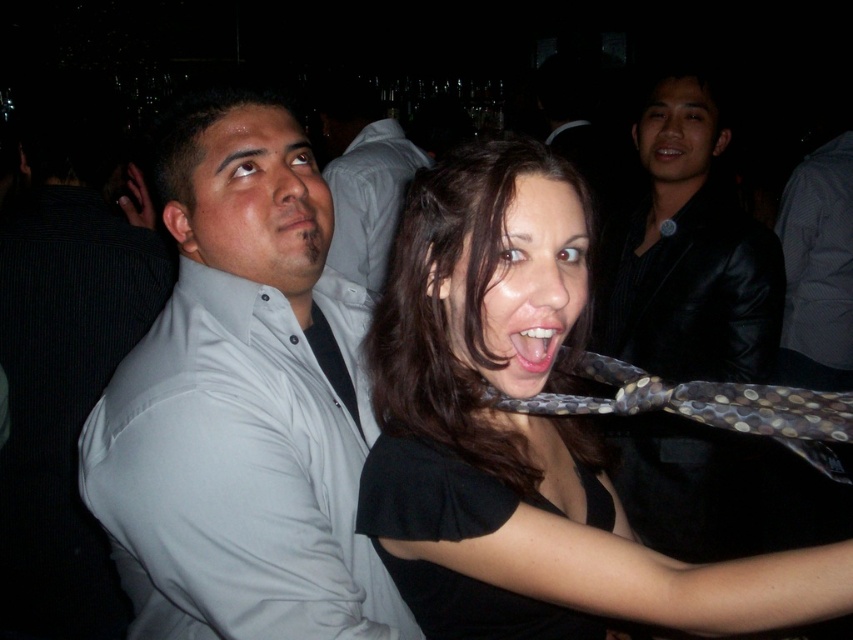
Is polka dot fabric tie at center taller than black leather jacket at upper right?

No.

Who is positioned more to the left, polka dot fabric tie at center or black leather jacket at upper right?

polka dot fabric tie at center is more to the left.

Based on the photo, who is more distant from viewer, (535, 484) or (695, 317)?

Point (695, 317)

Locate an element on the screen. polka dot fabric tie at center is located at coordinates (524, 435).

Is polka dot fabric tie at center thinner than matte white shirt at upper center?

In fact, polka dot fabric tie at center might be wider than matte white shirt at upper center.

Does polka dot fabric tie at center have a lesser height compared to matte white shirt at upper center?

Correct, polka dot fabric tie at center is not as tall as matte white shirt at upper center.

Who is more distant from viewer, (462, 324) or (389, 211)?

The point (389, 211) is more distant.

Locate an element on the screen. The image size is (853, 640). polka dot fabric tie at center is located at coordinates (524, 435).

Consider the image. Which of these two, matte white shirt at upper center or smooth white teeth at center, stands shorter?

smooth white teeth at center is shorter.

Between matte white shirt at upper center and smooth white teeth at center, which one is positioned lower?

smooth white teeth at center is below.

Is point (401, 134) closer to camera compared to point (543, 317)?

No, it is behind (543, 317).

This screenshot has height=640, width=853. In order to click on matte white shirt at upper center in this screenshot , I will do (x=363, y=179).